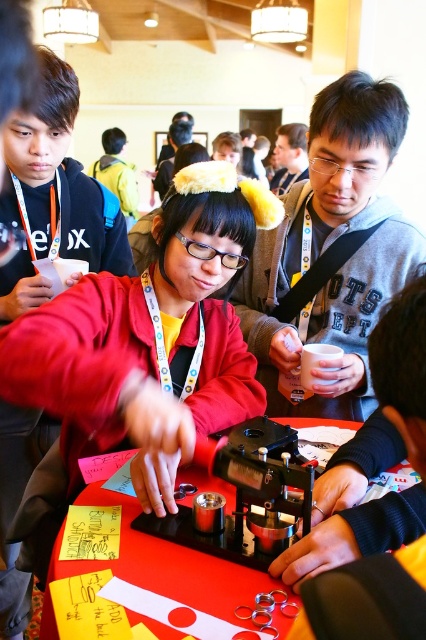
Question: Which point is farther to the camera?

Choices:
 (A) red plastic table at center
 (B) matte gray hoodie at center

Answer: (B)

Question: Can you confirm if matte gray hoodie at center is bigger than red plastic table at center?

Choices:
 (A) yes
 (B) no

Answer: (A)

Question: Does matte gray hoodie at center lie in front of red plastic table at center?

Choices:
 (A) yes
 (B) no

Answer: (B)

Question: Among these objects, which one is farthest from the camera?

Choices:
 (A) matte gray hoodie at center
 (B) red plastic table at center

Answer: (A)

Question: Is matte gray hoodie at center positioned at the back of red plastic table at center?

Choices:
 (A) no
 (B) yes

Answer: (B)

Question: Which object appears farthest from the camera in this image?

Choices:
 (A) red plastic table at center
 (B) matte gray hoodie at center

Answer: (B)